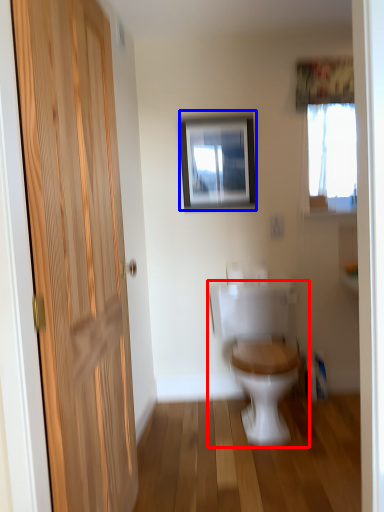
Question: Which object appears closest to the camera in this image, toilet (highlighted by a red box) or picture frame (highlighted by a blue box)?

Choices:
 (A) toilet
 (B) picture frame

Answer: (A)